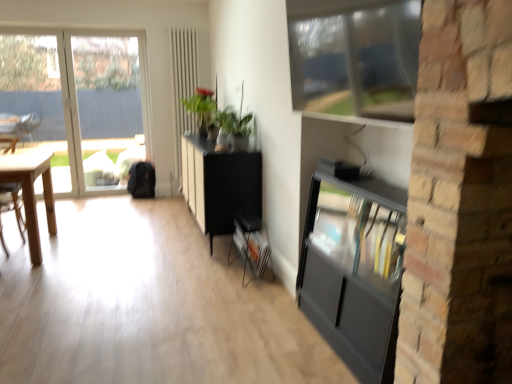
Where is `white matte radiator at upper center`? Image resolution: width=512 pixels, height=384 pixels. white matte radiator at upper center is located at coordinates (183, 86).

Describe the element at coordinates (80, 101) in the screenshot. Image resolution: width=512 pixels, height=384 pixels. I see `transparent glass window at left, the 2th window viewed from the right` at that location.

Where is `matte black cabinet at right`? This screenshot has width=512, height=384. matte black cabinet at right is located at coordinates (354, 270).

At what (x,y) coordinates should I click in order to perform the action: click on light wood desk at left. Please return your answer as a coordinate pair (x, y). Looking at the image, I should click on (32, 192).

Is point (389, 295) positioned behind point (103, 144)?

No, it is not.

Which is in front, matte black cabinet at right or transparent glass window at left, which is the second window from front to back?

matte black cabinet at right is more forward.

Which object is thinner, matte black cabinet at right or transparent glass window at left, which is the second window from front to back?

With smaller width is transparent glass window at left, which is the second window from front to back.

From the image's perspective, is matte black cabinet at right over transparent glass window at left, which is the 1th window in left-to-right order?

No, from the image's perspective, matte black cabinet at right is not over transparent glass window at left, which is the 1th window in left-to-right order.

This screenshot has width=512, height=384. In order to click on desk in front of the white matte radiator at upper center in this screenshot , I will do `click(32, 192)`.

Can you confirm if white matte radiator at upper center is smaller than light wood desk at left?

Yes, white matte radiator at upper center is smaller than light wood desk at left.

Is white matte radiator at upper center spatially inside light wood desk at left, or outside of it?

white matte radiator at upper center is spatially situated outside light wood desk at left.

From the image's perspective, relative to light wood desk at left, is white matte radiator at upper center above or below?

Clearly, from the image's perspective, white matte radiator at upper center is above light wood desk at left.

From a real-world perspective, does black matte cabinet at center stand above light wood desk at left?

Yes, from a real-world perspective, black matte cabinet at center is above light wood desk at left.

Find the location of `desk that appears in front of the black matte cabinet at center`. desk that appears in front of the black matte cabinet at center is located at coordinates (32, 192).

Considering the sizes of black matte cabinet at center and light wood desk at left in the image, is black matte cabinet at center taller or shorter than light wood desk at left?

In the image, black matte cabinet at center appears to be taller than light wood desk at left.

The image size is (512, 384). Find the location of `screen door to the left of matte black cabinet at right`. screen door to the left of matte black cabinet at right is located at coordinates (183, 86).

Is white matte radiator at upper center positioned far away from matte black cabinet at right?

white matte radiator at upper center is positioned a significant distance from matte black cabinet at right.

From the image's perspective, is white matte radiator at upper center above or below matte black cabinet at right?

white matte radiator at upper center is above matte black cabinet at right.

Could you tell me if white matte radiator at upper center is turned towards matte black cabinet at right?

Yes, white matte radiator at upper center faces towards matte black cabinet at right.

Looking at the image, does clear glass window at upper center, positioned as the 2th window in left-to-right order, seem bigger or smaller compared to light wood desk at left?

clear glass window at upper center, positioned as the 2th window in left-to-right order, is smaller than light wood desk at left.

Is clear glass window at upper center, the 1th window viewed from the right, positioned behind light wood desk at left?

No.

From a real-world perspective, is clear glass window at upper center, the 1th window from the front, physically located above or below light wood desk at left?

In terms of real-world spatial position, clear glass window at upper center, the 1th window from the front, is above light wood desk at left.

Does light wood desk at left have a smaller size compared to metallic gray magazine rack at center?

Actually, light wood desk at left might be larger than metallic gray magazine rack at center.

Is light wood desk at left situated inside metallic gray magazine rack at center or outside?

light wood desk at left exists outside the volume of metallic gray magazine rack at center.

Is light wood desk at left further to camera compared to metallic gray magazine rack at center?

Yes, light wood desk at left is further from the viewer.

Does clear glass window at upper center, positioned as the 2th window in left-to-right order, have a smaller size compared to black matte cabinet at center?

Correct, clear glass window at upper center, positioned as the 2th window in left-to-right order, occupies less space than black matte cabinet at center.

Is clear glass window at upper center, the 1th window viewed from the right, to the left of black matte cabinet at center from the viewer's perspective?

No, clear glass window at upper center, the 1th window viewed from the right, is not to the left of black matte cabinet at center.

Between clear glass window at upper center, positioned as the 2th window in left-to-right order, and black matte cabinet at center, which one has more height?

black matte cabinet at center is taller.

Which of these two, clear glass window at upper center, the 1th window from the front, or black matte cabinet at center, is thinner?

black matte cabinet at center.

What are the coordinates of `tv cabinet below the transparent glass window at left, which is the 1th window in left-to-right order (from a real-world perspective)` in the screenshot? It's located at (354, 270).

Find the location of a particular element. The height and width of the screenshot is (384, 512). desk below the white matte radiator at upper center (from the image's perspective) is located at coordinates (32, 192).

When comparing their distances from white matte radiator at upper center, does clear glass window at upper center, the 1th window viewed from the right, or black matte cabinet at center seem closer?

Among the two, black matte cabinet at center is located nearer to white matte radiator at upper center.

Estimate the real-world distances between objects in this image. Which object is closer to black matte cabinet at center, white matte radiator at upper center or matte black cabinet at right?

Based on the image, matte black cabinet at right appears to be nearer to black matte cabinet at center.

Considering their positions, is matte black cabinet at right positioned closer to black matte cabinet at center than clear glass window at upper center, the 1th window from the front?

matte black cabinet at right.

From the image, which object appears to be farther from metallic gray magazine rack at center, clear glass window at upper center, positioned as the 2th window in left-to-right order, or black matte cabinet at center?

clear glass window at upper center, positioned as the 2th window in left-to-right order, is positioned further to the anchor metallic gray magazine rack at center.

Looking at the image, which one is located further to light wood desk at left, metallic gray magazine rack at center or black matte cabinet at center?

metallic gray magazine rack at center lies further to light wood desk at left than the other object.

From the image, which object appears to be nearer to transparent glass window at left, which is the second window from front to back, matte black cabinet at right or white matte radiator at upper center?

Based on the image, white matte radiator at upper center appears to be nearer to transparent glass window at left, which is the second window from front to back.

When comparing their distances from clear glass window at upper center, the 1th window from the front, does white matte radiator at upper center or light wood desk at left seem closer?

light wood desk at left.

Estimate the real-world distances between objects in this image. Which object is further from metallic gray magazine rack at center, light wood desk at left or white matte radiator at upper center?

The object further to metallic gray magazine rack at center is white matte radiator at upper center.

Identify the location of shelf positioned between clear glass window at upper center, the 2th window from the back, and transparent glass window at left, the 2th window viewed from the right, from near to far. (251, 244).

This screenshot has width=512, height=384. Identify the location of desk between matte black cabinet at right and transparent glass window at left, which is the 1th window in left-to-right order, along the z-axis. (32, 192).

The image size is (512, 384). In order to click on shelf between matte black cabinet at right and transparent glass window at left, which is the second window from front to back, along the z-axis in this screenshot , I will do `click(251, 244)`.

Identify the location of shelf between clear glass window at upper center, the 1th window from the front, and black matte cabinet at center in the front-back direction. (251, 244).